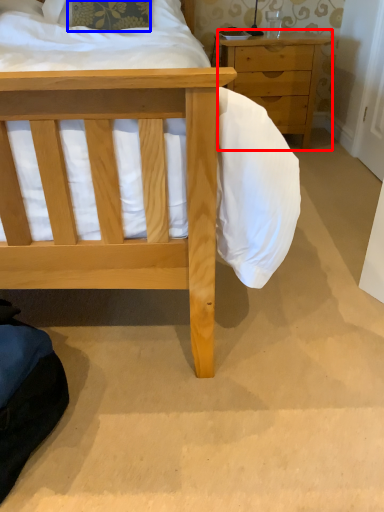
Question: Which object is closer to the camera taking this photo, chest of drawers (highlighted by a red box) or pillow (highlighted by a blue box)?

Choices:
 (A) chest of drawers
 (B) pillow

Answer: (B)